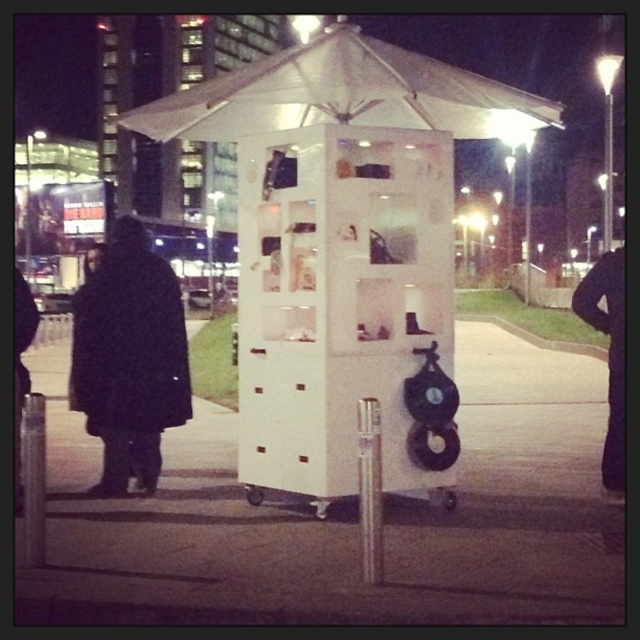
Consider the image. Does white matte cart at center have a smaller size compared to black matte coat at left?

No.

Is white matte cart at center closer to the viewer compared to black matte coat at left?

Yes, white matte cart at center is in front of black matte coat at left.

Does point (529, 513) come behind point (106, 465)?

No, (529, 513) is in front of (106, 465).

You are a GUI agent. You are given a task and a screenshot of the screen. Output one action in this format:
    pyautogui.click(x=<x>, y=<y>)
    Task: Click on the white matte cart at center
    The height and width of the screenshot is (640, 640).
    Given the screenshot: What is the action you would take?
    (348, 516)

Does white matte cart at center appear over white matte gazebo at center?

Incorrect, white matte cart at center is not positioned above white matte gazebo at center.

Which is in front, point (609, 516) or point (392, 115)?

Point (609, 516)

The width and height of the screenshot is (640, 640). Identify the location of white matte cart at center. (348, 516).

What do you see at coordinates (342, 96) in the screenshot? I see `white fabric canopy at upper center` at bounding box center [342, 96].

Which is more to the left, white fabric canopy at upper center or black matte coat at left?

From the viewer's perspective, black matte coat at left appears more on the left side.

This screenshot has width=640, height=640. I want to click on white fabric canopy at upper center, so pyautogui.click(x=342, y=96).

Find the location of `white fabric canopy at upper center`. white fabric canopy at upper center is located at coordinates (342, 96).